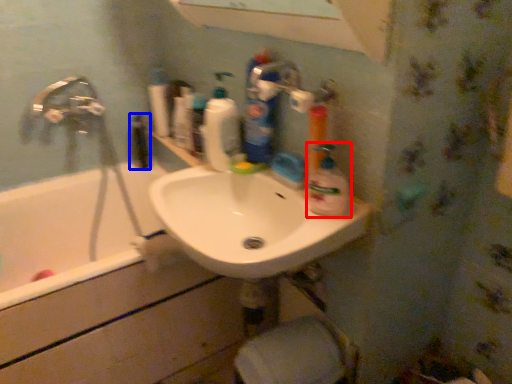
Question: Which of the following is the closest to the observer, cleaning product (highlighted by a red box) or mouthwash (highlighted by a blue box)?

Choices:
 (A) cleaning product
 (B) mouthwash

Answer: (A)